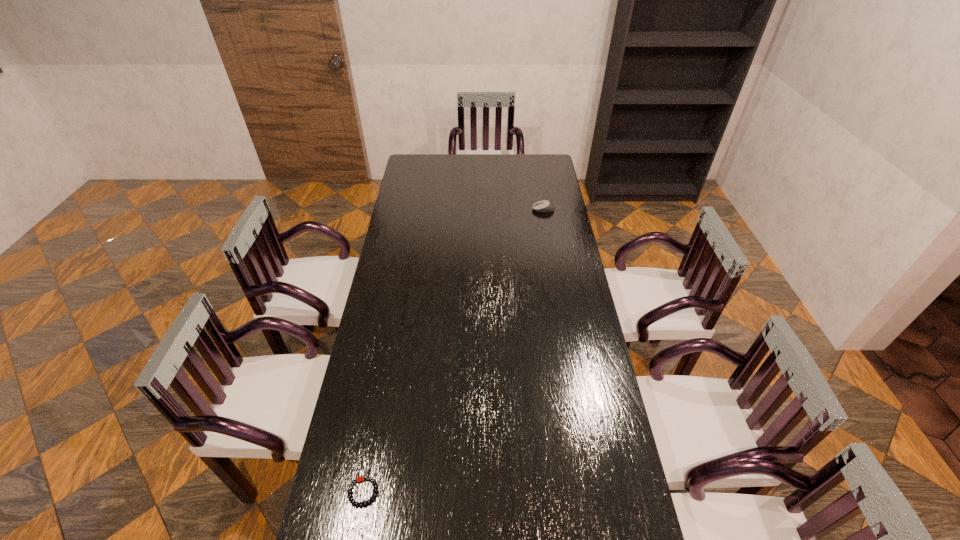
The height and width of the screenshot is (540, 960). In order to click on free space at the far edge of the desktop in this screenshot , I will do `click(465, 155)`.

In the image, there is a desktop. Where is `vacant space at the left edge`? The height and width of the screenshot is (540, 960). vacant space at the left edge is located at coordinates (393, 388).

I want to click on free space at the right edge, so click(596, 343).

Image resolution: width=960 pixels, height=540 pixels. I want to click on free spot at the far left corner of the desktop, so click(x=413, y=167).

Where is `vacant area that lies between the shorter object and the right object`? vacant area that lies between the shorter object and the right object is located at coordinates (453, 350).

Locate an element on the screen. Image resolution: width=960 pixels, height=540 pixels. blank region between the bracelet and the right object is located at coordinates (453, 350).

Where is `vacant region between the farther object and the bracelet`? The image size is (960, 540). vacant region between the farther object and the bracelet is located at coordinates (453, 350).

This screenshot has height=540, width=960. I want to click on vacant position in the image that satisfies the following two spatial constraints: 1. on the wheel side of the computer equipment; 2. on the front side of the nearer object, so click(593, 492).